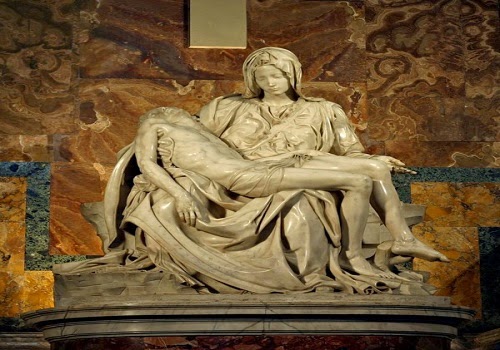
Find the location of a particular element. Image resolution: width=500 pixels, height=350 pixels. statue hand is located at coordinates (183, 214), (394, 166), (162, 151).